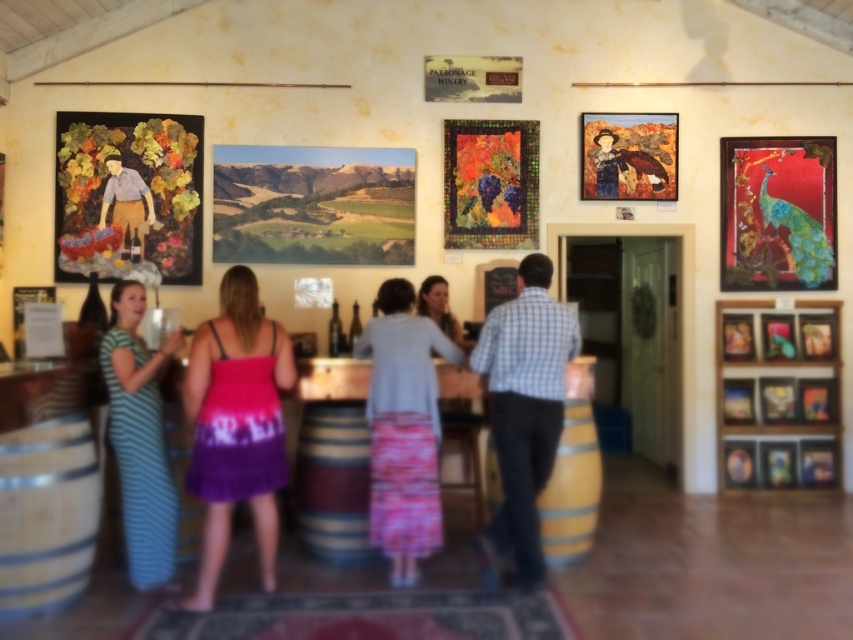
Between purple tie-dye dress at center and matte wooden picture frame at center, which one appears on the right side from the viewer's perspective?

matte wooden picture frame at center is more to the right.

Is purple tie-dye dress at center smaller than matte wooden picture frame at center?

No, purple tie-dye dress at center is not smaller than matte wooden picture frame at center.

This screenshot has height=640, width=853. Find the location of `purple tie-dye dress at center`. purple tie-dye dress at center is located at coordinates click(x=236, y=426).

Is matte gray shirt at center positioned at the back of metallic gold picture frame at upper right?

No, matte gray shirt at center is in front of metallic gold picture frame at upper right.

This screenshot has height=640, width=853. What do you see at coordinates (440, 310) in the screenshot? I see `matte gray shirt at center` at bounding box center [440, 310].

This screenshot has width=853, height=640. Describe the element at coordinates (440, 310) in the screenshot. I see `matte gray shirt at center` at that location.

Find the location of a particular element. Image resolution: width=853 pixels, height=640 pixels. matte gray shirt at center is located at coordinates (440, 310).

How far apart are textured fabric painting of woman at left and matte wooden picture frame at center?

A distance of 31.60 inches exists between textured fabric painting of woman at left and matte wooden picture frame at center.

Is textured fabric painting of woman at left bigger than matte wooden picture frame at center?

Yes, textured fabric painting of woman at left is bigger than matte wooden picture frame at center.

Who is more distant from viewer, (80, 269) or (321, 232)?

Point (321, 232)

Find the location of a particular element. This screenshot has width=853, height=640. textured fabric painting of woman at left is located at coordinates (128, 195).